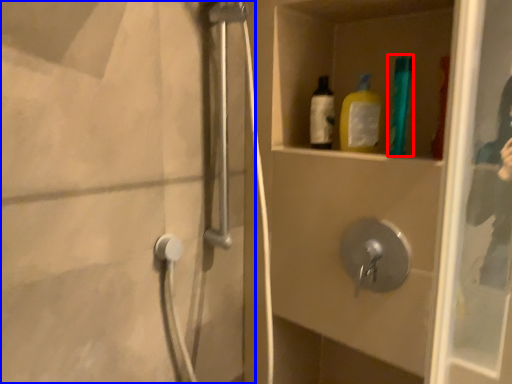
Question: Which point is further to the camera, bottle (highlighted by a red box) or screen door (highlighted by a blue box)?

Choices:
 (A) bottle
 (B) screen door

Answer: (A)